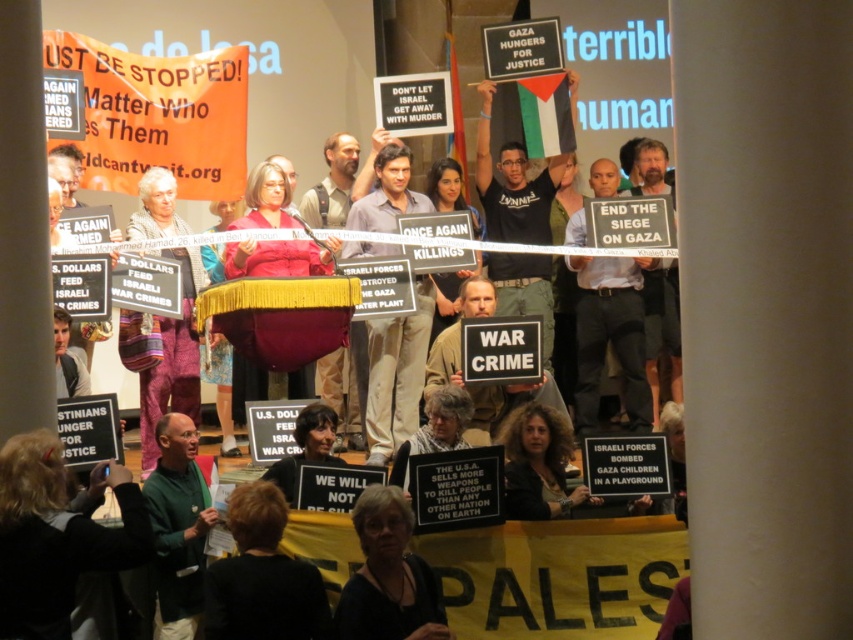
Question: Is white paper sign at center below black fabric sign at center-right?

Choices:
 (A) yes
 (B) no

Answer: (A)

Question: Which of the following is the closest to the observer?

Choices:
 (A) black fabric sign at center-right
 (B) white paper sign at center

Answer: (B)

Question: Does white paper sign at center appear over black fabric sign at center-right?

Choices:
 (A) yes
 (B) no

Answer: (B)

Question: Does white paper sign at center have a smaller size compared to black fabric sign at center-right?

Choices:
 (A) no
 (B) yes

Answer: (A)

Question: Which point is closer to the camera?

Choices:
 (A) black fabric sign at center-right
 (B) white paper sign at center

Answer: (B)